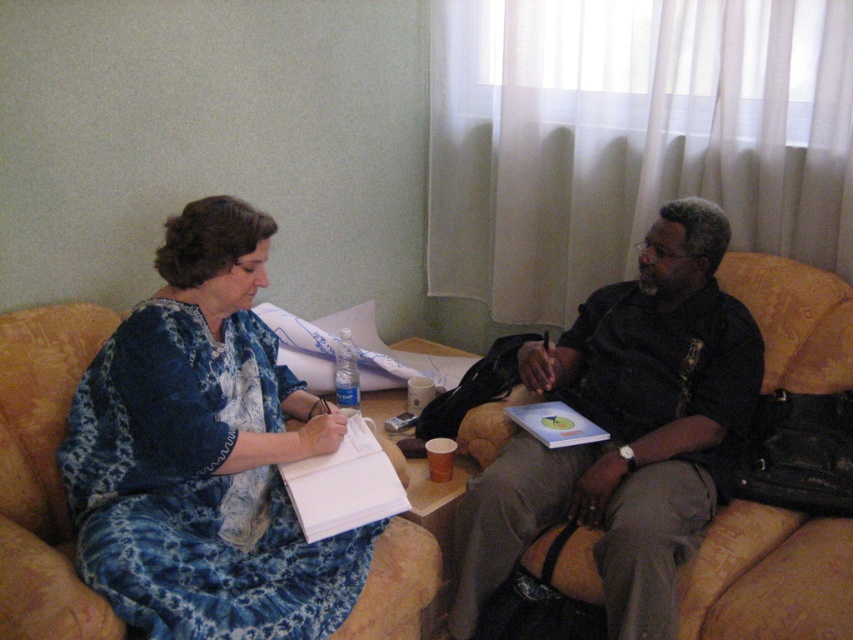
How distant is blue printed dress at left from dark brown leather jacket at center?

blue printed dress at left and dark brown leather jacket at center are 23.80 inches apart from each other.

Which is in front, point (215, 493) or point (697, 294)?

Point (215, 493)

This screenshot has height=640, width=853. What are the coordinates of `blue printed dress at left` in the screenshot? It's located at (204, 452).